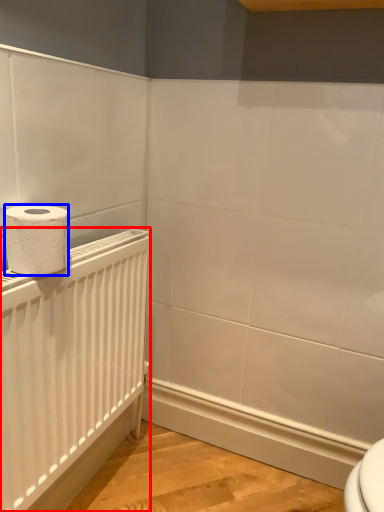
Question: Which object is further to the camera taking this photo, radiator (highlighted by a red box) or toilet paper (highlighted by a blue box)?

Choices:
 (A) radiator
 (B) toilet paper

Answer: (B)